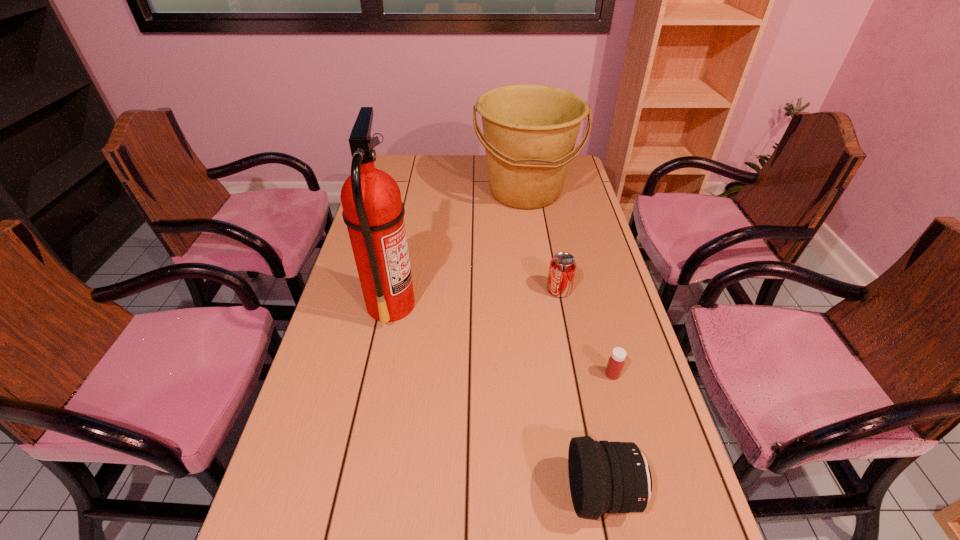
Image resolution: width=960 pixels, height=540 pixels. In order to click on soda can located in the right edge section of the desktop in this screenshot , I will do `click(562, 268)`.

You are a GUI agent. You are given a task and a screenshot of the screen. Output one action in this format:
    pyautogui.click(x=<x>, y=<y>)
    Task: Click on the medicine located at the right edge
    
    Given the screenshot: What is the action you would take?
    616,361

The height and width of the screenshot is (540, 960). Find the location of `object that is at the far right corner`. object that is at the far right corner is located at coordinates (530, 130).

What are the coordinates of `vacant area at the far edge of the desktop` in the screenshot? It's located at (439, 175).

This screenshot has width=960, height=540. Identify the location of vacant space at the left edge of the desktop. (356, 321).

Identify the location of free space at the right edge. (617, 310).

At what (x,y) coordinates should I click in order to perform the action: click on free space at the far left corner of the desktop. Please return your answer as a coordinate pair (x, y). Image resolution: width=960 pixels, height=540 pixels. Looking at the image, I should click on (398, 160).

The height and width of the screenshot is (540, 960). In order to click on empty space between the soda can and the third tallest object in this screenshot , I will do `click(581, 392)`.

Locate an element on the screen. Image resolution: width=960 pixels, height=540 pixels. free space that is in between the nearest object and the soda can is located at coordinates (581, 392).

Identify the location of free space between the medicine and the telephoto lens. Image resolution: width=960 pixels, height=540 pixels. (608, 434).